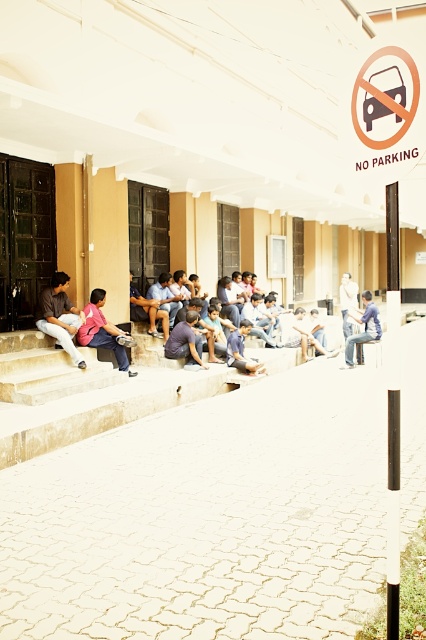
Question: Which point appears closest to the camera in this image?

Choices:
 (A) (72, 353)
 (B) (88, 340)
 (C) (397, 580)
 (D) (374, 321)

Answer: (C)

Question: Is black glossy pole at center thinner than blue denim jeans at center?

Choices:
 (A) no
 (B) yes

Answer: (B)

Question: Is pink fabric shirt at lower left to the right of blue denim jeans at center from the viewer's perspective?

Choices:
 (A) no
 (B) yes

Answer: (A)

Question: Which is nearer to the blue denim jeans at center?

Choices:
 (A) matte brown shirt at lower left
 (B) pink fabric shirt at lower left
 (C) black glossy pole at center

Answer: (B)

Question: Which of the following is the farthest from the observer?

Choices:
 (A) (365, 323)
 (B) (97, 342)
 (C) (397, 611)

Answer: (A)

Question: Does black glossy pole at center lie behind blue denim jeans at center?

Choices:
 (A) yes
 (B) no

Answer: (B)